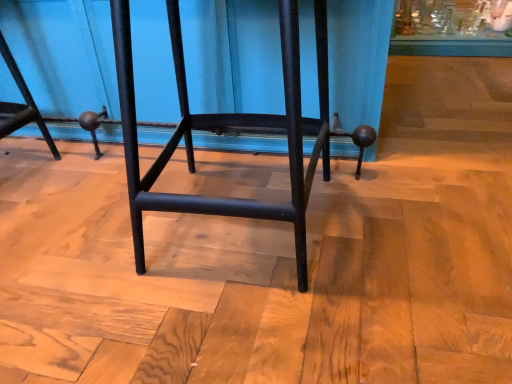
The height and width of the screenshot is (384, 512). Describe the element at coordinates (226, 129) in the screenshot. I see `black matte metal chair at center` at that location.

The width and height of the screenshot is (512, 384). Find the location of `black matte metal chair at center`. black matte metal chair at center is located at coordinates (226, 129).

In order to face black matte metal chair at center, should I rotate leftwards or rightwards?

Turn left by 2.853 degrees to look at black matte metal chair at center.

Where is `black matte metal chair at center`? black matte metal chair at center is located at coordinates (226, 129).